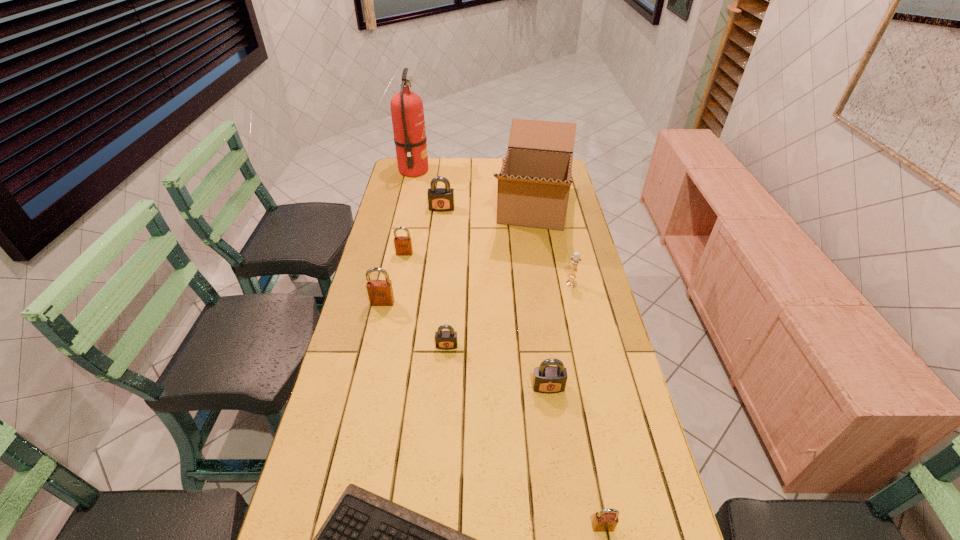
I want to click on the second smallest gray padlock, so pos(547,379).

This screenshot has width=960, height=540. I want to click on the fifth padlock from left to right, so coord(547,379).

Where is `the fourth farthest padlock`? the fourth farthest padlock is located at coordinates (445, 340).

Where is `the seventh farthest object`? This screenshot has height=540, width=960. the seventh farthest object is located at coordinates (445, 340).

Find the location of a particular element. the rightmost padlock is located at coordinates (606, 520).

Locate an element on the screen. The image size is (960, 540). the rightmost brown padlock is located at coordinates (606, 520).

Locate an element on the screen. The height and width of the screenshot is (540, 960). vacant region located on the side of the fire extinguisher with the nozzle and handle is located at coordinates (480, 171).

This screenshot has width=960, height=540. I want to click on free space located 0.090m on the back of the box, so click(527, 168).

Where is `free spot located 0.140m on the front of the farthest padlock near the keyhole`? This screenshot has height=540, width=960. free spot located 0.140m on the front of the farthest padlock near the keyhole is located at coordinates (439, 232).

What are the coordinates of `vacant space located 0.280m on the front-facing side of the second nearest brown padlock` in the screenshot? It's located at (365, 379).